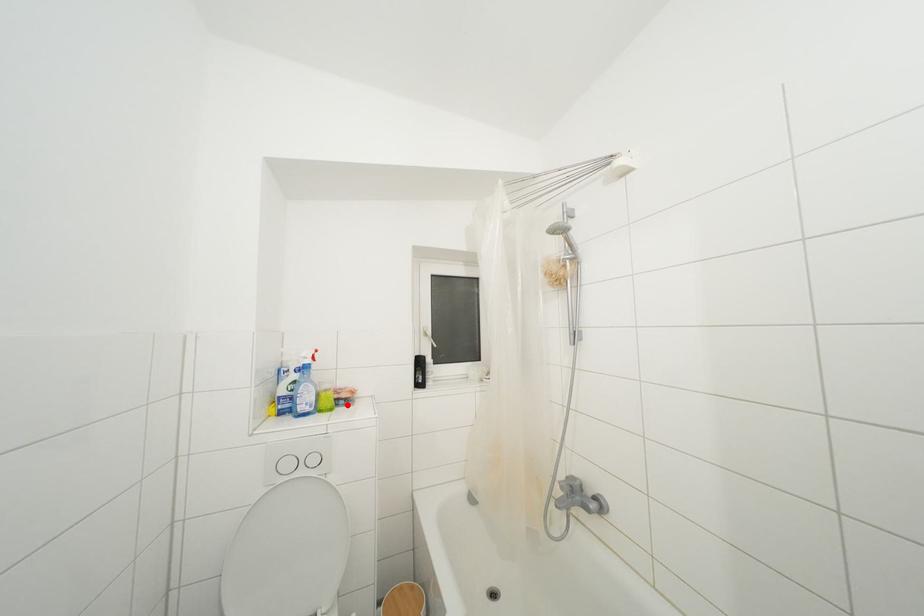
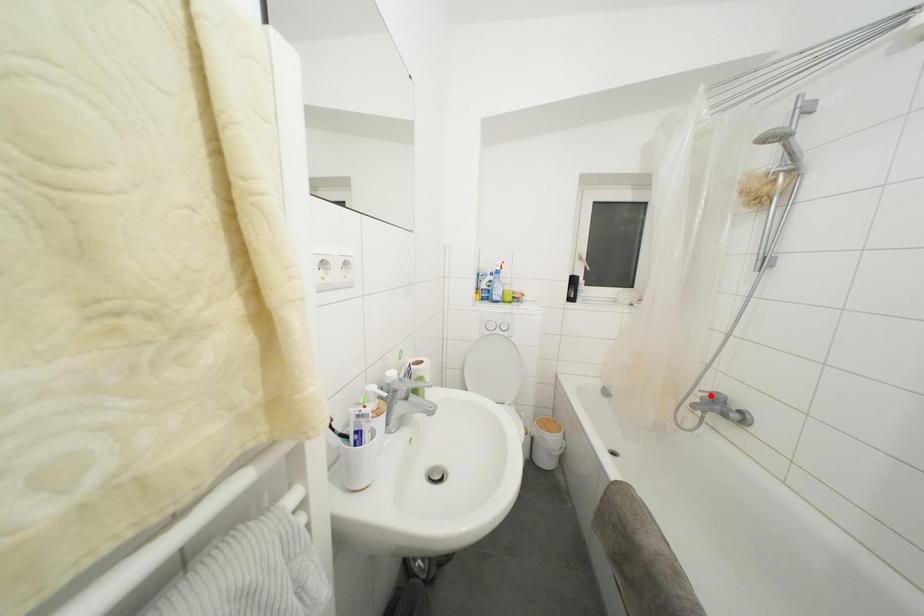
I am providing you with two images of the same scene from different viewpoints. A red point is marked on the first image and another point is marked on the second image. Is the marked point in image1 the same physical position as the marked point in image2?

No